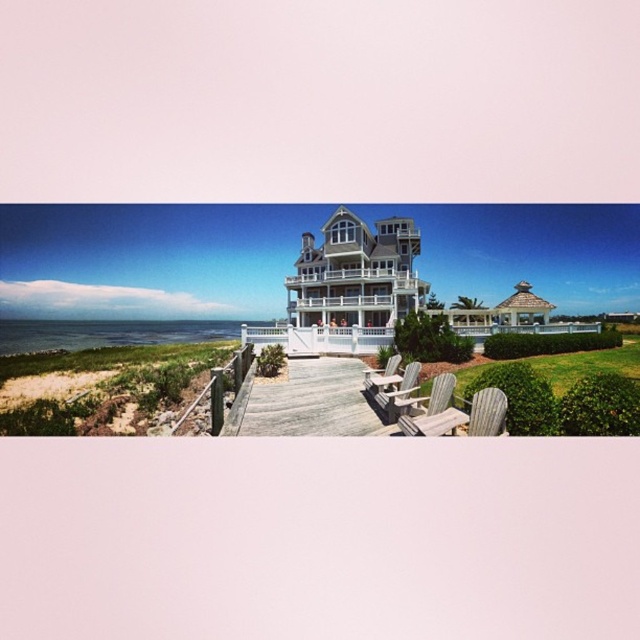
Who is positioned more to the right, wooden textured beach chair at lower right or wooden beach chair at lower center?

wooden textured beach chair at lower right is more to the right.

Does wooden textured beach chair at lower right appear under wooden beach chair at lower center?

No, wooden textured beach chair at lower right is not below wooden beach chair at lower center.

Is point (481, 417) positioned behind point (387, 392)?

No, (481, 417) is in front of (387, 392).

Find the location of a particular element. Image resolution: width=640 pixels, height=640 pixels. wooden textured beach chair at lower right is located at coordinates (486, 412).

Can you confirm if wooden beach chair at center is positioned below light gray wooden beach chair at lower center?

Correct, wooden beach chair at center is located below light gray wooden beach chair at lower center.

Image resolution: width=640 pixels, height=640 pixels. What do you see at coordinates (435, 412) in the screenshot?
I see `wooden beach chair at center` at bounding box center [435, 412].

Which is behind, point (467, 420) or point (385, 371)?

Point (385, 371)

Identify the location of wooden beach chair at center. (435, 412).

The width and height of the screenshot is (640, 640). I want to click on wooden beach chair at lower center, so click(397, 392).

Does wooden beach chair at lower center have a greater width compared to light gray wooden beach chair at lower center?

In fact, wooden beach chair at lower center might be narrower than light gray wooden beach chair at lower center.

The image size is (640, 640). What are the coordinates of `wooden beach chair at lower center` in the screenshot? It's located at (397, 392).